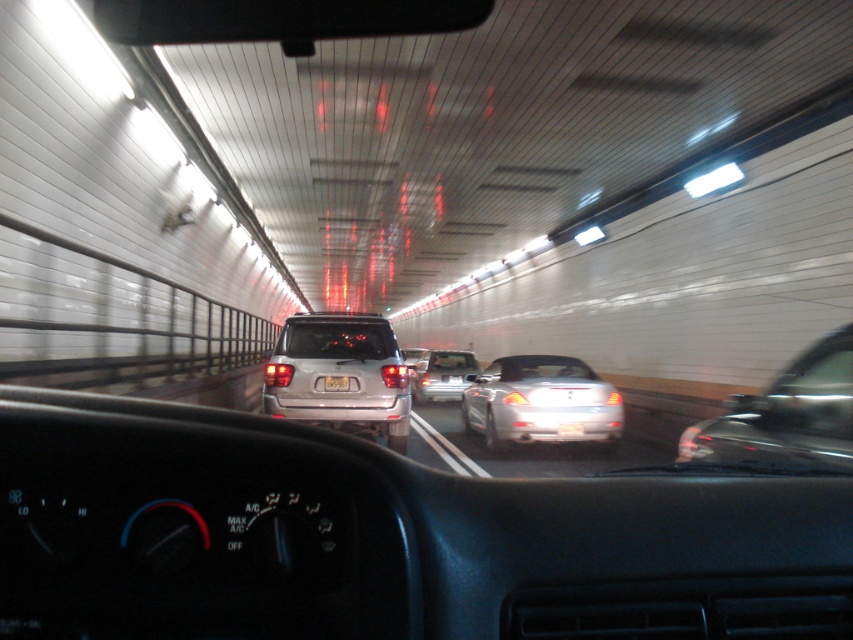
You are driving a car and see two silver sedans ahead. The metallic silver sedan at right and the satin silver sedan at center. Which one is closer to you?

The metallic silver sedan at right is in front of the satin silver sedan at center, so it is closer to you.

You are driving through the tunnel and want to know if the point at coordinate (802, 358) is closer to your vehicle compared to the point at (424, 392). Based on the scene, can you determine which point is nearer to your current position?

Yes, according to the scene description, the point at coordinate (802, 358) is closer to the camera than the point at (424, 392). Since you are in the driver seat, the point at (802, 358) would be nearer to your current position.

You are driving a car that is 4.5 meters long. You want to overtake the silver metallic sedan at center in the tunnel. Is there enough space between your car and the sedan to safely complete the maneuver?

The distance between your car and the silver metallic sedan at center is 8.94 meters. Since your car is 4.5 meters long, you have sufficient space to safely overtake the sedan as the distance is greater than the length of your vehicle.